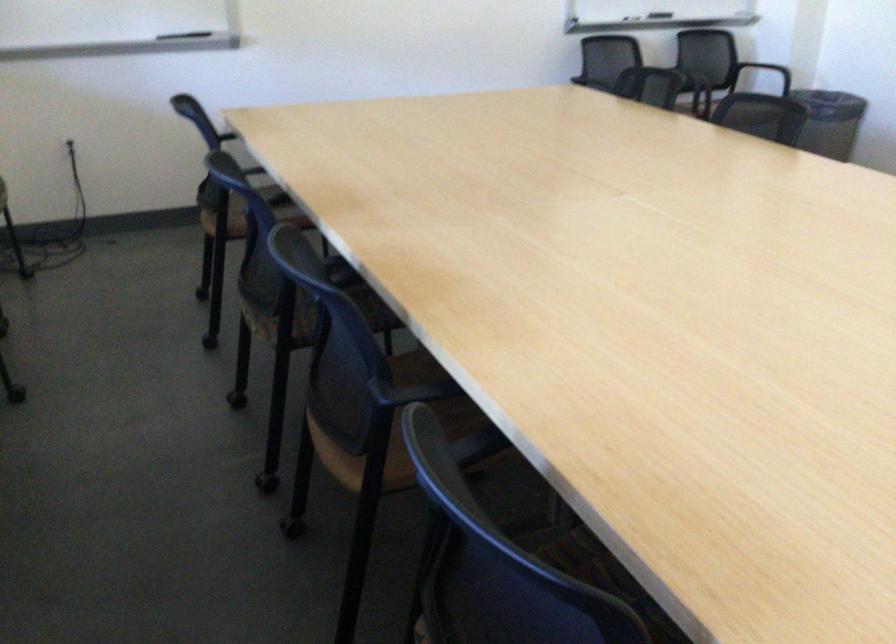
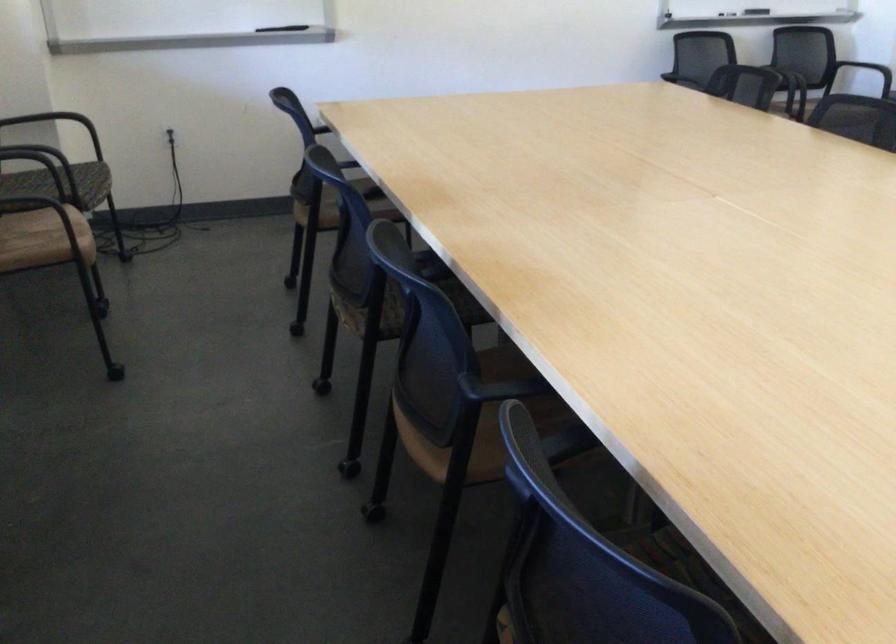
Question: How did the camera likely rotate?

Choices:
 (A) Left
 (B) Right
 (C) Up
 (D) Down

Answer: (A)